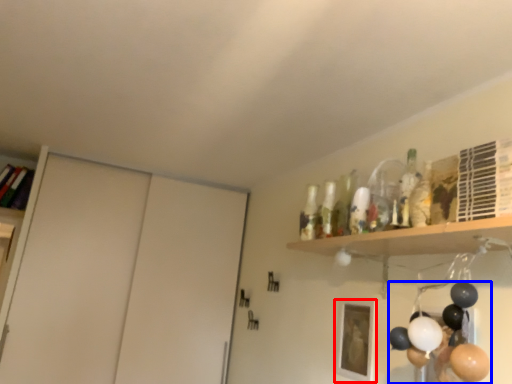
Question: Which object appears closest to the camera in this image, picture frame (highlighted by a red box) or balloon (highlighted by a blue box)?

Choices:
 (A) picture frame
 (B) balloon

Answer: (B)